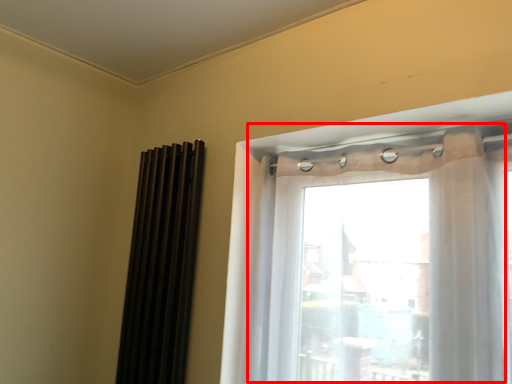
Question: From the image, what is the correct spatial relationship of window (annotated by the red box) in relation to shutter?

Choices:
 (A) left
 (B) right

Answer: (B)